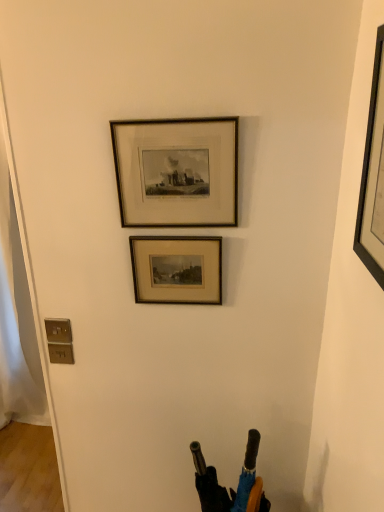
Question: Which direction should I rotate to look at wooden framed print at center, positioned as the 3th picture frame in front-to-back order?

Choices:
 (A) right
 (B) left

Answer: (B)

Question: Is black matte picture frame at upper right, the 3th picture frame when ordered from back to front, turned away from wooden frame at upper center, the second picture frame from the front?

Choices:
 (A) yes
 (B) no

Answer: (B)

Question: Can you confirm if black matte picture frame at upper right, which appears as the 1th picture frame when viewed from the front, is positioned to the right of wooden frame at upper center, marked as the 2th picture frame in a back-to-front arrangement?

Choices:
 (A) yes
 (B) no

Answer: (A)

Question: Considering the relative sizes of black matte picture frame at upper right, which appears as the 1th picture frame when viewed from the front, and wooden frame at upper center, the second picture frame from the front, in the image provided, is black matte picture frame at upper right, which appears as the 1th picture frame when viewed from the front, taller than wooden frame at upper center, the second picture frame from the front,?

Choices:
 (A) no
 (B) yes

Answer: (B)

Question: Is black matte picture frame at upper right, the 3th picture frame when ordered from back to front, positioned behind wooden frame at upper center, the second picture frame from the front?

Choices:
 (A) no
 (B) yes

Answer: (A)

Question: Does black matte picture frame at upper right, which appears as the 1th picture frame when viewed from the front, have a lesser height compared to wooden frame at upper center, the second picture frame from the front?

Choices:
 (A) no
 (B) yes

Answer: (A)

Question: Can you confirm if black matte picture frame at upper right, the 3th picture frame when ordered from back to front, is thinner than wooden frame at upper center, the second picture frame from the front?

Choices:
 (A) no
 (B) yes

Answer: (A)

Question: Does wooden frame at upper center, the second picture frame from the front, come behind black matte picture frame at upper right, which appears as the 1th picture frame when viewed from the front?

Choices:
 (A) no
 (B) yes

Answer: (B)

Question: From the image's perspective, is wooden frame at upper center, the second picture frame from the front, on black matte picture frame at upper right, the 3th picture frame when ordered from back to front?

Choices:
 (A) yes
 (B) no

Answer: (A)

Question: Is wooden frame at upper center, marked as the 2th picture frame in a back-to-front arrangement, facing away from black matte picture frame at upper right, the 3th picture frame when ordered from back to front?

Choices:
 (A) yes
 (B) no

Answer: (B)

Question: Can we say wooden frame at upper center, marked as the 2th picture frame in a back-to-front arrangement, lies outside black matte picture frame at upper right, which appears as the 1th picture frame when viewed from the front?

Choices:
 (A) no
 (B) yes

Answer: (B)

Question: Is wooden frame at upper center, marked as the 2th picture frame in a back-to-front arrangement, surrounding black matte picture frame at upper right, the 3th picture frame when ordered from back to front?

Choices:
 (A) no
 (B) yes

Answer: (A)

Question: Does wooden frame at upper center, the second picture frame from the front, appear on the right side of black matte picture frame at upper right, the 3th picture frame when ordered from back to front?

Choices:
 (A) no
 (B) yes

Answer: (A)

Question: Can you confirm if wooden framed print at center, positioned as the 3th picture frame in front-to-back order, is positioned to the left of wooden frame at upper center, the second picture frame from the front?

Choices:
 (A) yes
 (B) no

Answer: (A)